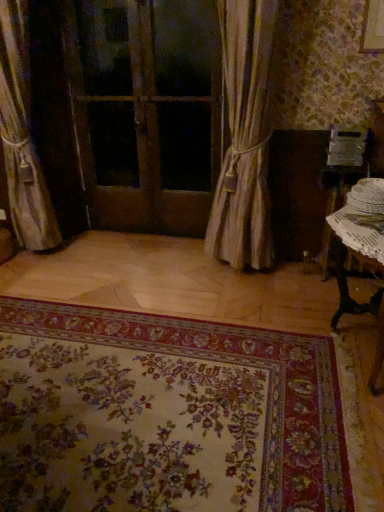
Image resolution: width=384 pixels, height=512 pixels. In order to click on vacant space to the right of silky beige curtain at left, which appears as the second curtain when viewed from the right in this screenshot , I will do `click(105, 245)`.